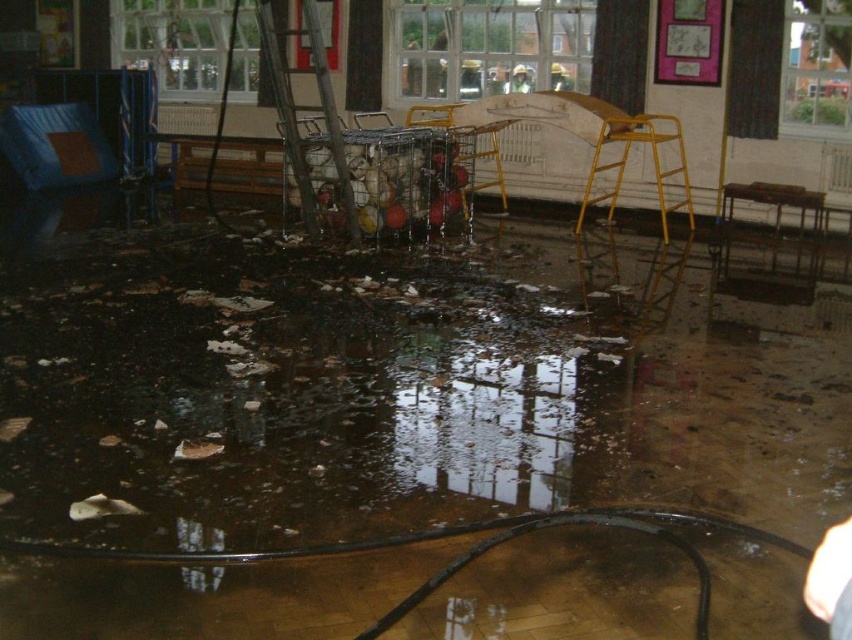
Question: Among these points, which one is nearest to the camera?

Choices:
 (A) (528, 88)
 (B) (563, 81)
 (C) (459, 76)

Answer: (B)

Question: Among these points, which one is farthest from the camera?

Choices:
 (A) [556, 77]
 (B) [263, 26]

Answer: (A)

Question: Is white fabric at lower right to the left of metallic yellow stool at lower right from the viewer's perspective?

Choices:
 (A) yes
 (B) no

Answer: (A)

Question: Which point is farther from the camera taking this photo?

Choices:
 (A) (812, 561)
 (B) (68, 134)

Answer: (B)

Question: Does yellow metal stool at center appear over metallic yellow stool at lower right?

Choices:
 (A) no
 (B) yes

Answer: (B)

Question: Does blue fabric chair at left appear under white fabric at lower right?

Choices:
 (A) yes
 (B) no

Answer: (B)